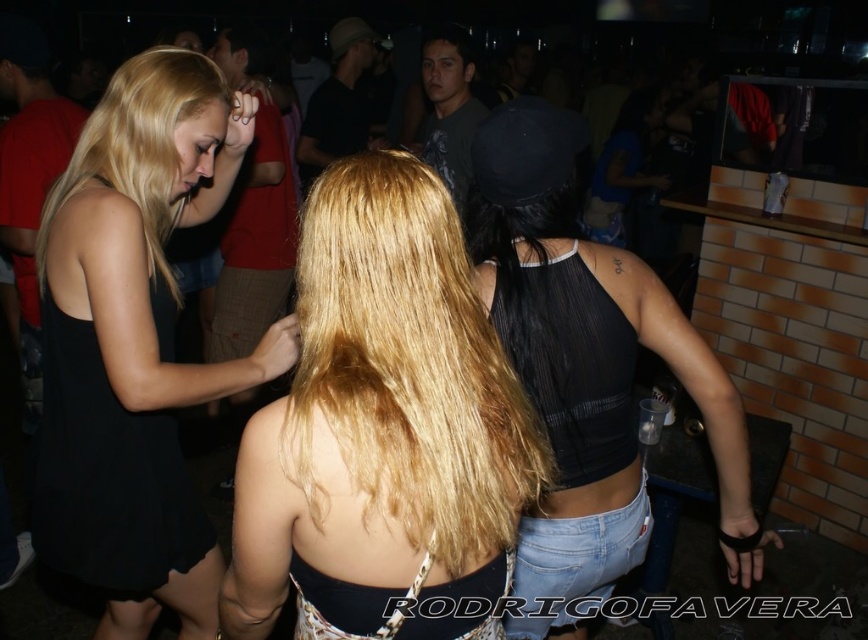
You are a photographer trying to capture a candid shot of the two people in the center and upper left of the image. Given that your camera has a fixed focal length that can only accommodate objects of equal width, will you need to adjust your framing to ensure both the black mesh tank top at center and the blonde silky hair at upper left fit within the frame?

The black mesh tank top at center has a greater width than the blonde silky hair at upper left, so you will need to adjust your framing to ensure both fit within the frame since their widths are not equal.